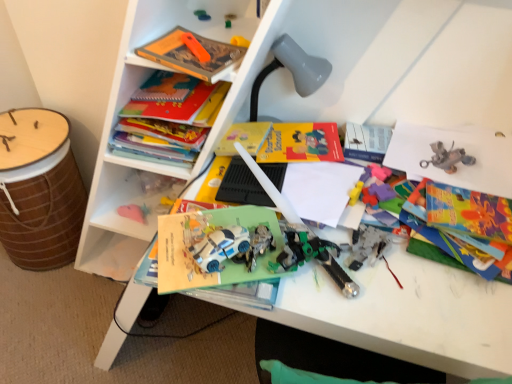
Question: Is hardcover book at upper left, which is the 1th book from back to front, not near matte plastic toy at upper center, acting as the 4th toy starting from the right?

Choices:
 (A) no
 (B) yes

Answer: (A)

Question: Can you confirm if hardcover book at upper left, which is the 1th book from back to front, is positioned to the right of matte plastic toy at upper center, acting as the 4th toy starting from the right?

Choices:
 (A) yes
 (B) no

Answer: (B)

Question: Does hardcover book at upper left, which appears as the 2th book when viewed from the front, have a greater width compared to matte plastic toy at upper center, which ranks as the 1th toy in left-to-right order?

Choices:
 (A) yes
 (B) no

Answer: (A)

Question: Could you tell me if hardcover book at upper left, which is the 1th book from back to front, is facing matte plastic toy at upper center, the 1th toy from the top?

Choices:
 (A) yes
 (B) no

Answer: (B)

Question: From the image's perspective, would you say hardcover book at upper left, which appears as the 2th book when viewed from the front, is positioned over matte plastic toy at upper center, which ranks as the 1th toy in left-to-right order?

Choices:
 (A) no
 (B) yes

Answer: (A)

Question: Can you confirm if hardcover book at upper left, which appears as the 2th book when viewed from the front, is shorter than matte plastic toy at upper center, arranged as the 4th toy when ordered from the bottom?

Choices:
 (A) yes
 (B) no

Answer: (B)

Question: Is orange plastic toy at upper center, which is the second toy from bottom to top, facing away from rubberized plastic puzzle pieces at center, which ranks as the fourth toy in top-to-bottom order?

Choices:
 (A) no
 (B) yes

Answer: (A)

Question: Considering the relative positions of orange plastic toy at upper center, placed as the 3th toy when sorted from right to left, and rubberized plastic puzzle pieces at center, the first toy when ordered from bottom to top, in the image provided, is orange plastic toy at upper center, placed as the 3th toy when sorted from right to left, behind rubberized plastic puzzle pieces at center, the first toy when ordered from bottom to top,?

Choices:
 (A) yes
 (B) no

Answer: (B)

Question: Can you confirm if orange plastic toy at upper center, which is the second toy from bottom to top, is thinner than rubberized plastic puzzle pieces at center, the first toy when ordered from bottom to top?

Choices:
 (A) yes
 (B) no

Answer: (A)

Question: Does orange plastic toy at upper center, which is the second toy from bottom to top, contain rubberized plastic puzzle pieces at center, the 4th toy when ordered from left to right?

Choices:
 (A) no
 (B) yes

Answer: (A)

Question: From a real-world perspective, is orange plastic toy at upper center, which ranks as the third toy in top-to-bottom order, beneath rubberized plastic puzzle pieces at center, the first toy when ordered from bottom to top?

Choices:
 (A) yes
 (B) no

Answer: (B)

Question: From the image's perspective, would you say orange plastic toy at upper center, placed as the 3th toy when sorted from right to left, is shown under rubberized plastic puzzle pieces at center, which ranks as the fourth toy in top-to-bottom order?

Choices:
 (A) no
 (B) yes

Answer: (A)

Question: Can you confirm if rubberized plastic puzzle pieces at center, the 4th toy when ordered from left to right, is wider than green plastic toy at center, the third toy in the left-to-right sequence?

Choices:
 (A) yes
 (B) no

Answer: (A)